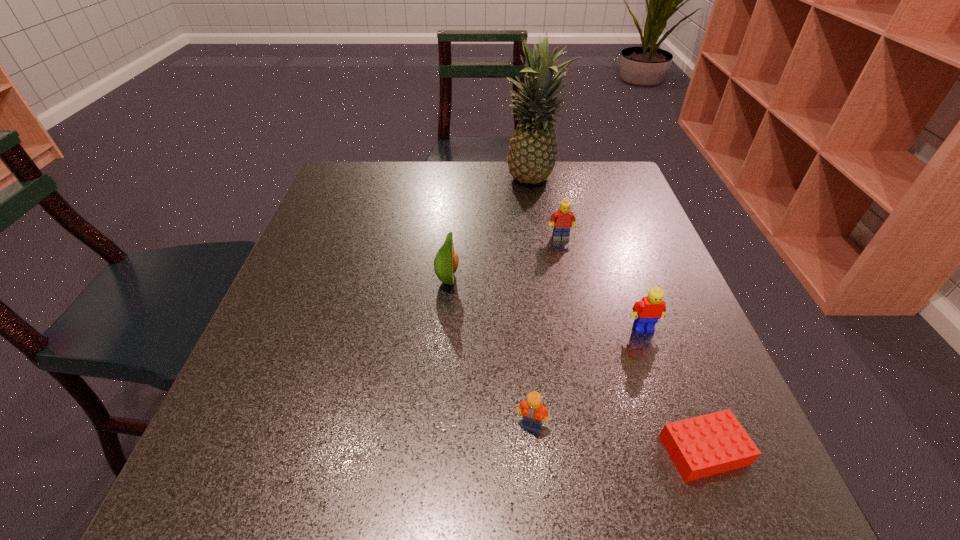
What are the coordinates of `free region at the left edge of the desktop` in the screenshot? It's located at (340, 214).

The width and height of the screenshot is (960, 540). What are the coordinates of `vacant space at the right edge of the desktop` in the screenshot? It's located at (622, 282).

Identify the location of free space at the far left corner. The image size is (960, 540). (347, 168).

You are a GUI agent. You are given a task and a screenshot of the screen. Output one action in this format:
    pyautogui.click(x=<x>, y=<y>)
    Task: Click on the vacant space at the near left corner of the desktop
    This screenshot has height=540, width=960.
    Given the screenshot: What is the action you would take?
    pyautogui.click(x=271, y=494)

In the image, there is a desktop. Where is `vacant region at the far right corner`? vacant region at the far right corner is located at coordinates 577,188.

I want to click on vacant space at the near right corner, so click(732, 507).

Locate an element on the screen. Image resolution: width=960 pixels, height=540 pixels. free space between the shortest object and the farthest object is located at coordinates (617, 316).

What are the coordinates of `vacant region between the shortest object and the second farthest object` in the screenshot? It's located at (632, 344).

Where is `vacant space in between the farthest Lego and the farthest object`? vacant space in between the farthest Lego and the farthest object is located at coordinates (546, 210).

At what (x,y) coordinates should I click in order to perform the action: click on empty space that is in between the second shortest object and the fourth farthest object. Please return your answer as a coordinate pair (x, y). Looking at the image, I should click on (588, 377).